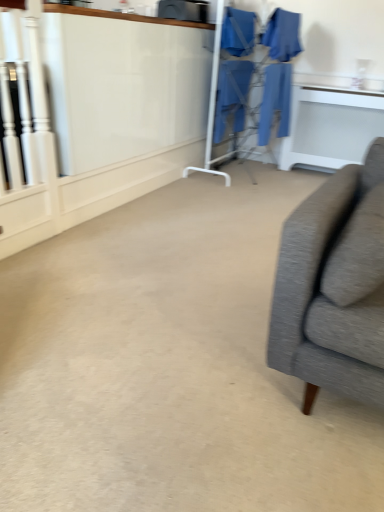
You are a GUI agent. You are given a task and a screenshot of the screen. Output one action in this format:
    pyautogui.click(x=<x>, y=<y>)
    Task: Click on the blue fabric robe at center, the second robe positioned from the left
    
    Given the screenshot: What is the action you would take?
    pyautogui.click(x=232, y=95)

Find the location of a particular element. This screenshot has width=384, height=512. white glossy table at upper right is located at coordinates (331, 126).

Measure the distance between blue fabric laundry at center and camera.

They are 3.71 meters apart.

This screenshot has height=512, width=384. Identify the location of blue fabric laundry at center. (278, 71).

The width and height of the screenshot is (384, 512). What are the coordinates of `blue fabric robe at center, the third robe when ordered from right to left` in the screenshot? It's located at (232, 95).

Consider the image. Based on their positions, is blue fabric robe at center, marked as the 1th robe in a left-to-right arrangement, located to the left or right of blue fabric robe at center, which appears as the 1th robe when viewed from the right?

Clearly, blue fabric robe at center, marked as the 1th robe in a left-to-right arrangement, is on the left of blue fabric robe at center, which appears as the 1th robe when viewed from the right, in the image.

Which robe is the 1st one when counting from the front of the blue fabric robe at center, marked as the 1th robe in a left-to-right arrangement? Please provide its 2D coordinates.

[(275, 101)]

What's the angular difference between blue fabric robe at center, the 4th robe when ordered from right to left, and blue fabric robe at center, which appears as the 1th robe when viewed from the right,'s facing directions?

The angle between the facing direction of blue fabric robe at center, the 4th robe when ordered from right to left, and the facing direction of blue fabric robe at center, which appears as the 1th robe when viewed from the right, is 0.254 degrees.

Between white glossy table at upper right and blue fabric robe at center, the 4th robe when ordered from right to left, which one appears on the right side from the viewer's perspective?

From the viewer's perspective, white glossy table at upper right appears more on the right side.

Does point (322, 93) come behind point (236, 28)?

Yes, point (322, 93) is farther from viewer.

From the image's perspective, is white glossy table at upper right positioned above or below blue fabric robe at center, the 4th robe when ordered from right to left?

Based on their image positions, white glossy table at upper right is located beneath blue fabric robe at center, the 4th robe when ordered from right to left.

Which object is closer to the camera, white glossy table at upper right or blue fabric robe at center, the 4th robe when ordered from right to left?

blue fabric robe at center, the 4th robe when ordered from right to left, is closer to the camera.

Is point (287, 129) closer or farther from the camera than point (277, 15)?

Clearly, point (287, 129) is more distant from the camera than point (277, 15).

Is blue fabric robe at center, acting as the 4th robe starting from the left, oriented towards blue fabric robe at upper center, the 2th robe when ordered from right to left?

No, blue fabric robe at center, acting as the 4th robe starting from the left, does not turn towards blue fabric robe at upper center, the 2th robe when ordered from right to left.

Can you confirm if blue fabric robe at center, acting as the 4th robe starting from the left, is shorter than blue fabric robe at upper center, the third robe in the left-to-right sequence?

No.

Measure the distance from blue fabric robe at center, which appears as the 1th robe when viewed from the right, to blue fabric robe at upper center, the third robe in the left-to-right sequence.

11.07 inches.

From the picture: Is there a large distance between blue fabric laundry at center and blue fabric robe at center, which appears as the 1th robe when viewed from the right?

Actually, blue fabric laundry at center and blue fabric robe at center, which appears as the 1th robe when viewed from the right, are a little close together.

Is point (298, 44) positioned in front of point (280, 81)?

That is False.

Is blue fabric laundry at center facing towards blue fabric robe at center, which appears as the 1th robe when viewed from the right?

No, blue fabric laundry at center is not oriented towards blue fabric robe at center, which appears as the 1th robe when viewed from the right.

How far apart are blue fabric laundry at center and blue fabric robe at center, which appears as the 1th robe when viewed from the right?

blue fabric laundry at center is 17.20 inches from blue fabric robe at center, which appears as the 1th robe when viewed from the right.

Locate an element on the screen. the 2nd robe positioned above the blue fabric robe at center, the second robe positioned from the left (from the image's perspective) is located at coordinates (238, 32).

Consider the image. Is blue fabric robe at center, marked as the 1th robe in a left-to-right arrangement, turned away from blue fabric robe at center, the second robe positioned from the left?

No, blue fabric robe at center, marked as the 1th robe in a left-to-right arrangement,'s orientation is not away from blue fabric robe at center, the second robe positioned from the left.

Which is more to the right, blue fabric robe at center, the 4th robe when ordered from right to left, or blue fabric robe at center, the third robe when ordered from right to left?

blue fabric robe at center, the third robe when ordered from right to left, is more to the right.

Considering the points (269, 115) and (299, 113), which point is in front, point (269, 115) or point (299, 113)?

The point (269, 115) is in front.

Considering the positions of objects blue fabric robe at center, which appears as the 1th robe when viewed from the right, and white glossy table at upper right in the image provided, who is more to the left, blue fabric robe at center, which appears as the 1th robe when viewed from the right, or white glossy table at upper right?

blue fabric robe at center, which appears as the 1th robe when viewed from the right.

What are the coordinates of `table that appears below the blue fabric robe at center, which appears as the 1th robe when viewed from the right (from the image's perspective)` in the screenshot? It's located at (331, 126).

Is blue fabric robe at upper center, the third robe in the left-to-right sequence, oriented away from blue fabric robe at center, the third robe when ordered from right to left?

blue fabric robe at upper center, the third robe in the left-to-right sequence, is not turned away from blue fabric robe at center, the third robe when ordered from right to left.

From a real-world perspective, is blue fabric robe at upper center, the third robe in the left-to-right sequence, above or below blue fabric robe at center, the second robe positioned from the left?

blue fabric robe at upper center, the third robe in the left-to-right sequence, is situated higher than blue fabric robe at center, the second robe positioned from the left, in the real world.

Identify the location of the 1st robe counting from the left of the blue fabric robe at upper center, the third robe in the left-to-right sequence. (232, 95).

Measure the distance between blue fabric robe at upper center, the third robe in the left-to-right sequence, and blue fabric robe at center, the second robe positioned from the left.

The distance of blue fabric robe at upper center, the third robe in the left-to-right sequence, from blue fabric robe at center, the second robe positioned from the left, is 21.60 inches.

Find the location of a particular element. Image resolution: width=384 pixels, height=512 pixels. robe that is the 2nd object directly below the blue fabric robe at center, the 4th robe when ordered from right to left (from a real-world perspective) is located at coordinates (275, 101).

Locate an element on the screen. Image resolution: width=384 pixels, height=512 pixels. table located on the right of blue fabric robe at center, the 4th robe when ordered from right to left is located at coordinates (331, 126).

Estimate the real-world distances between objects in this image. Which object is closer to blue fabric robe at center, the second robe positioned from the left, blue fabric robe at center, marked as the 1th robe in a left-to-right arrangement, or blue fabric robe at upper center, the 2th robe when ordered from right to left?

Based on the image, blue fabric robe at center, marked as the 1th robe in a left-to-right arrangement, appears to be nearer to blue fabric robe at center, the second robe positioned from the left.

Estimate the real-world distances between objects in this image. Which object is closer to blue fabric robe at center, which appears as the 1th robe when viewed from the right, blue fabric robe at upper center, the third robe in the left-to-right sequence, or blue fabric robe at center, the third robe when ordered from right to left?

Among the two, blue fabric robe at upper center, the third robe in the left-to-right sequence, is located nearer to blue fabric robe at center, which appears as the 1th robe when viewed from the right.

From the picture: From the image, which object appears to be nearer to blue fabric robe at center, the 4th robe when ordered from right to left, blue fabric robe at upper center, the third robe in the left-to-right sequence, or blue fabric laundry at center?

Based on the image, blue fabric laundry at center appears to be nearer to blue fabric robe at center, the 4th robe when ordered from right to left.

Looking at the image, which one is located further to white glossy table at upper right, blue fabric robe at center, the second robe positioned from the left, or blue fabric robe at upper center, the 2th robe when ordered from right to left?

The object further to white glossy table at upper right is blue fabric robe at upper center, the 2th robe when ordered from right to left.

Consider the image. Which object lies further to the anchor point white glossy table at upper right, blue fabric robe at center, which appears as the 1th robe when viewed from the right, or blue fabric robe at center, marked as the 1th robe in a left-to-right arrangement?

Among the two, blue fabric robe at center, marked as the 1th robe in a left-to-right arrangement, is located further to white glossy table at upper right.

From the image, which object appears to be farther from blue fabric robe at center, the third robe when ordered from right to left, white glossy table at upper right or blue fabric robe at center, the 4th robe when ordered from right to left?

white glossy table at upper right lies further to blue fabric robe at center, the third robe when ordered from right to left, than the other object.

Based on their spatial positions, is blue fabric robe at center, the second robe positioned from the left, or blue fabric robe at center, which appears as the 1th robe when viewed from the right, further from blue fabric laundry at center?

blue fabric robe at center, which appears as the 1th robe when viewed from the right, lies further to blue fabric laundry at center than the other object.

Looking at the image, which one is located closer to blue fabric robe at center, which appears as the 1th robe when viewed from the right, white glossy table at upper right or blue fabric robe at upper center, the 2th robe when ordered from right to left?

blue fabric robe at upper center, the 2th robe when ordered from right to left.

Where is `laundry between blue fabric robe at upper center, the 2th robe when ordered from right to left, and blue fabric robe at center, acting as the 4th robe starting from the left, from top to bottom`? The image size is (384, 512). laundry between blue fabric robe at upper center, the 2th robe when ordered from right to left, and blue fabric robe at center, acting as the 4th robe starting from the left, from top to bottom is located at coordinates (278, 71).

Locate an element on the screen. The width and height of the screenshot is (384, 512). laundry situated between blue fabric robe at center, the third robe when ordered from right to left, and blue fabric robe at center, which appears as the 1th robe when viewed from the right, from left to right is located at coordinates click(278, 71).

Where is `laundry between blue fabric robe at center, the second robe positioned from the left, and white glossy table at upper right from left to right`? Image resolution: width=384 pixels, height=512 pixels. laundry between blue fabric robe at center, the second robe positioned from the left, and white glossy table at upper right from left to right is located at coordinates (278, 71).

In order to click on robe between blue fabric robe at upper center, the third robe in the left-to-right sequence, and blue fabric robe at center, acting as the 4th robe starting from the left, from top to bottom in this screenshot , I will do `click(232, 95)`.